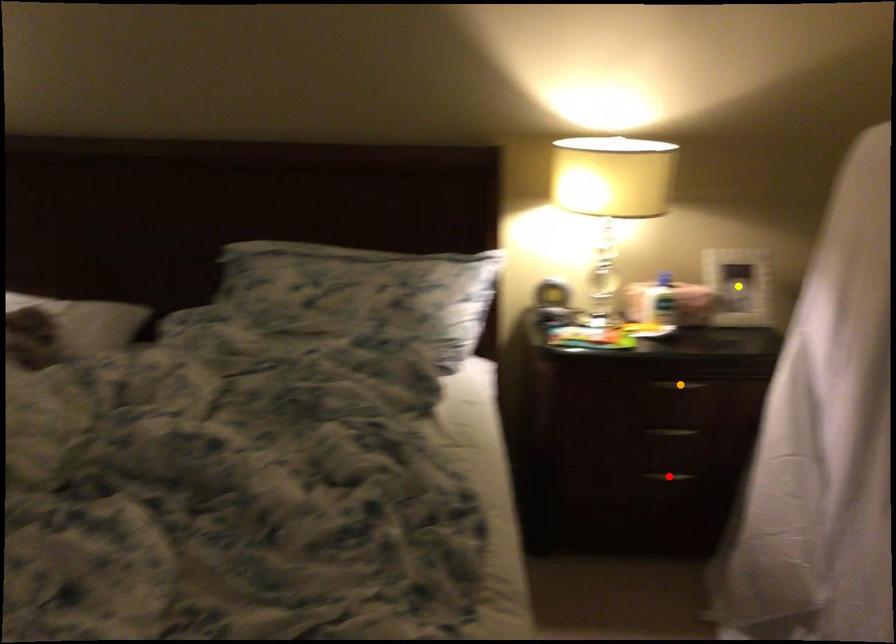
Order these from farthest to nearest:
A) red point
B) orange point
C) yellow point

yellow point, red point, orange point